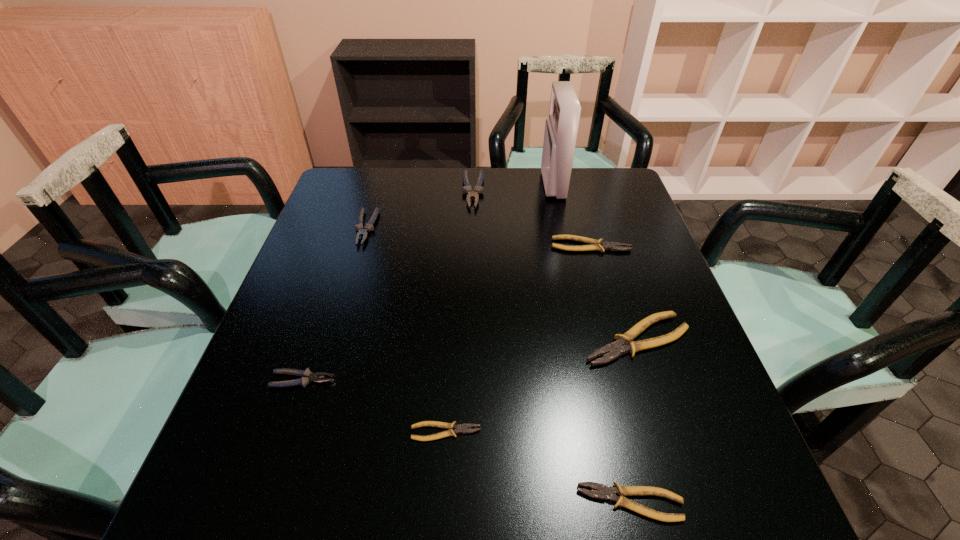
The height and width of the screenshot is (540, 960). Find the location of `free point between the first-aid kit and the third smallest yellow pliers`. free point between the first-aid kit and the third smallest yellow pliers is located at coordinates (571, 215).

Identify the location of empty space between the smallest gray pliers and the red first-aid kit. This screenshot has height=540, width=960. (428, 282).

At what (x,y) coordinates should I click in order to perform the action: click on free area in between the red first-aid kit and the fourth nearest pliers. Please return your answer as a coordinate pair (x, y). This screenshot has width=960, height=540. Looking at the image, I should click on tap(595, 262).

Locate which object is the second closest to the first-aid kit. Please provide its 2D coordinates. Your answer should be formatted as a tuple, i.e. [(x, y)], where the tuple contains the x and y coordinates of a point satisfying the conditions above.

[(466, 189)]

Select which object is the sixth closest to the second biggest yellow pliers. Please provide its 2D coordinates. Your answer should be formatted as a tuple, i.e. [(x, y)], where the tuple contains the x and y coordinates of a point satisfying the conditions above.

[(604, 492)]

Identify the location of the sixth closest pliers to the seventh farthest object. The width and height of the screenshot is (960, 540). (466, 189).

Locate which pliers ranks in proximity to the leftmost yellow pliers. Please provide its 2D coordinates. Your answer should be formatted as a tuple, i.e. [(x, y)], where the tuple contains the x and y coordinates of a point satisfying the conditions above.

[(604, 492)]

This screenshot has height=540, width=960. Find the location of `gray pliers that is the second closest to the second biggest gray pliers`. gray pliers that is the second closest to the second biggest gray pliers is located at coordinates click(x=307, y=376).

Where is `gray pliers that is the second closest one to the second smallest gray pliers`? This screenshot has height=540, width=960. gray pliers that is the second closest one to the second smallest gray pliers is located at coordinates pyautogui.click(x=307, y=376).

Locate an element on the screen. The width and height of the screenshot is (960, 540). yellow pliers object that ranks as the second closest to the third smallest yellow pliers is located at coordinates (463, 428).